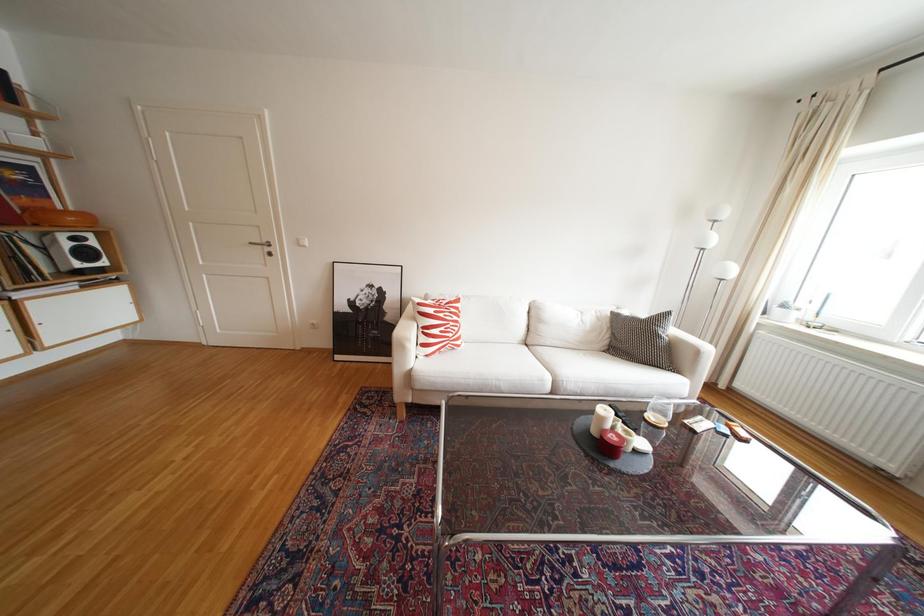
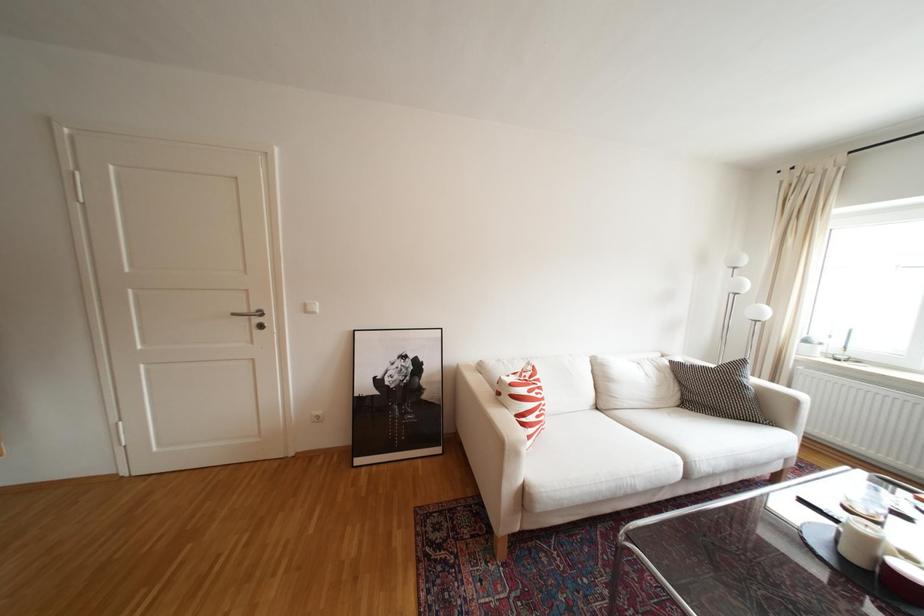
Which direction would the cameraman need to move to produce the second image?

The cameraman walked toward left, forward.